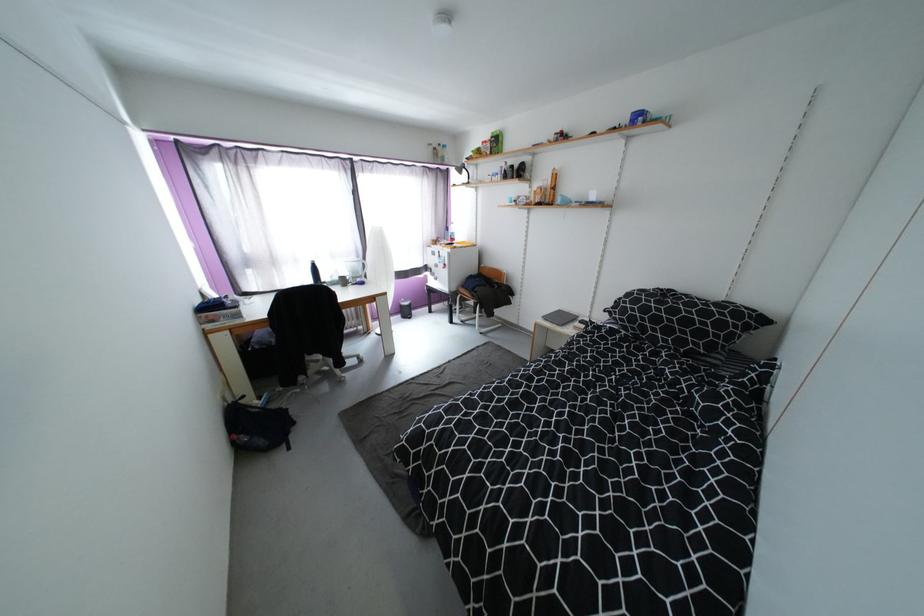
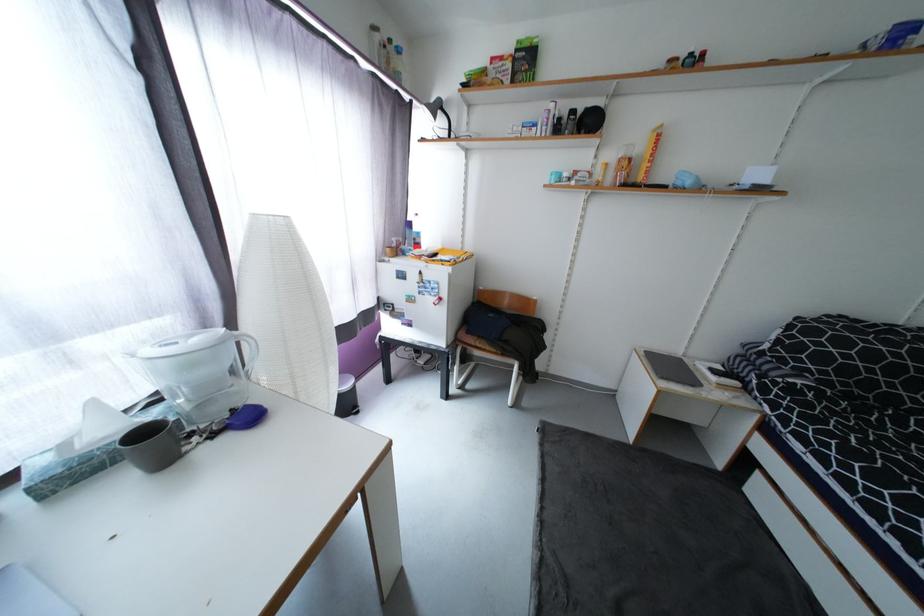
The point at (455, 363) is marked in the first image. Where is the corresponding point in the second image?

(548, 524)